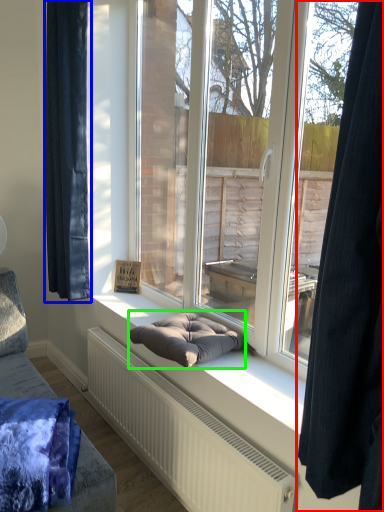
Question: Estimate the real-world distances between objects in this image. Which object is farther from curtain (highlighted by a red box), curtain (highlighted by a blue box) or footrest (highlighted by a green box)?

Choices:
 (A) curtain
 (B) footrest

Answer: (A)